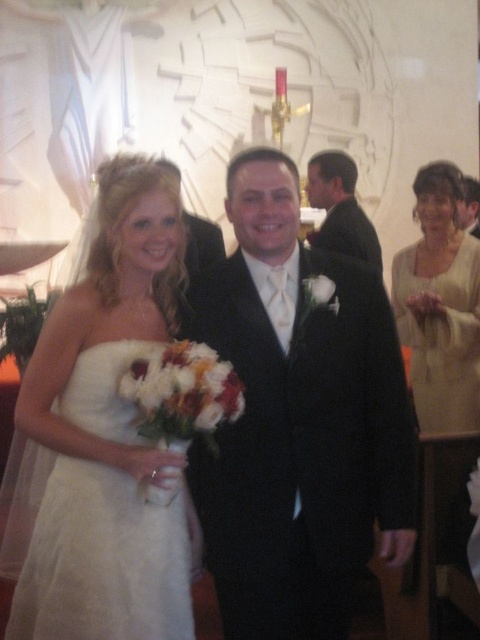
You are a photographer at a wedding and need to adjust the lighting for two guests wearing a matte cream blouse at right and an ivory satin dress at right. Since the dresses are both on the right side of the frame, which one is closer to the left edge of the frame?

The matte cream blouse at right is positioned on the left side of the ivory satin dress at right, so it is closer to the left edge of the frame.